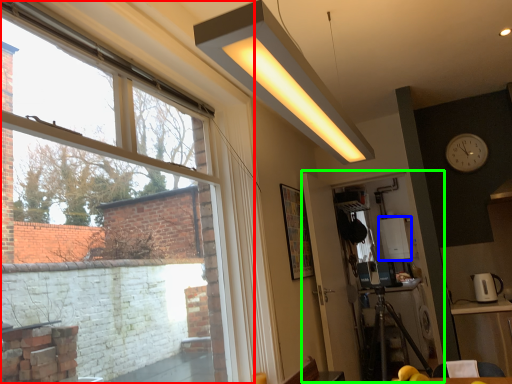
Question: Which is nearer to the window (highlighted by a red box)? appliance (highlighted by a blue box) or screen door (highlighted by a green box).

Choices:
 (A) appliance
 (B) screen door

Answer: (B)